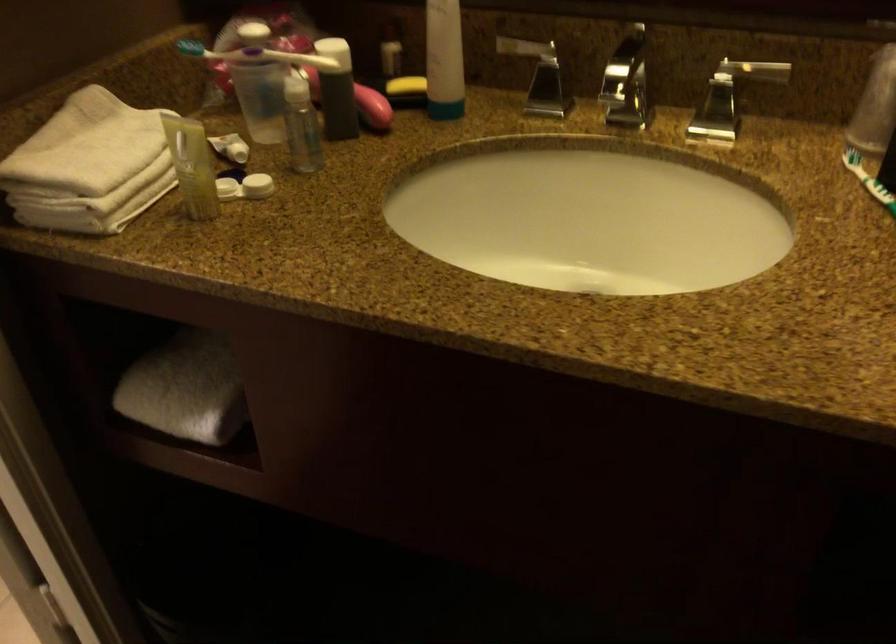
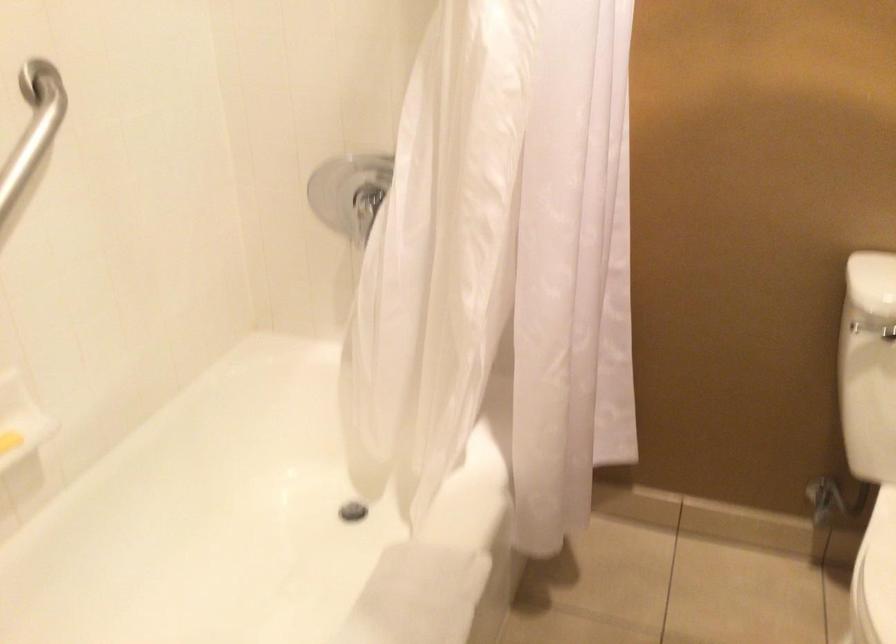
First-person continuous shooting, in which direction is the camera rotating?

The camera rotated toward left-down.